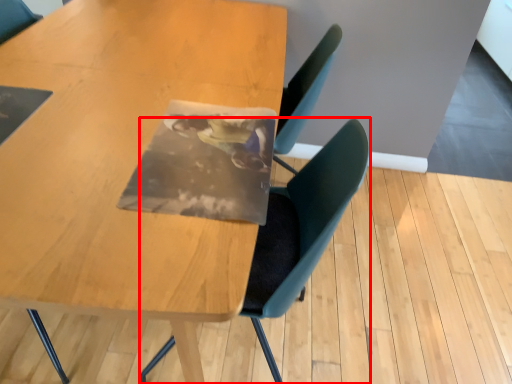
Question: Considering the relative positions of chair (annotated by the red box) and table in the image provided, where is chair (annotated by the red box) located with respect to the staircase?

Choices:
 (A) right
 (B) left

Answer: (A)